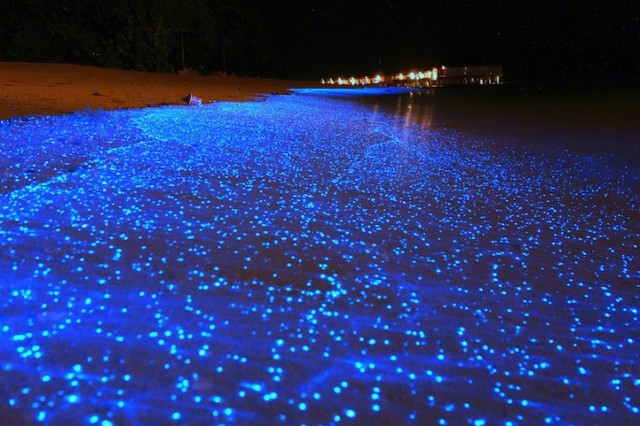
Where is `lights`? The width and height of the screenshot is (640, 426). lights is located at coordinates click(x=422, y=72), click(x=404, y=73), click(x=371, y=79), click(x=352, y=82), click(x=332, y=82).